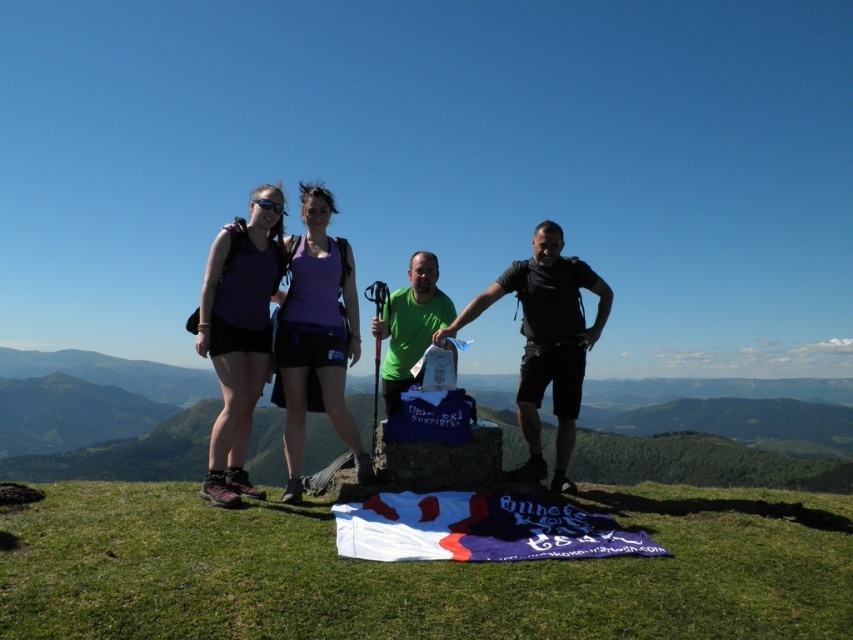
Question: Which object is closer to the camera taking this photo?

Choices:
 (A) matte purple shirt at left
 (B) green matte shirt at center
 (C) black matte shirt at center

Answer: (A)

Question: Which point is closer to the camera taking this photo?

Choices:
 (A) [262, 240]
 (B) [564, 269]

Answer: (A)

Question: Can you confirm if purple fabric tank top at center is positioned to the right of green matte shirt at center?

Choices:
 (A) yes
 (B) no

Answer: (B)

Question: Does black matte shirt at center have a smaller size compared to green matte shirt at center?

Choices:
 (A) no
 (B) yes

Answer: (A)

Question: Does matte purple shirt at left have a lesser width compared to black matte goggles at upper center?

Choices:
 (A) yes
 (B) no

Answer: (B)

Question: Which point is closer to the camera?

Choices:
 (A) green matte shirt at center
 (B) purple fabric tank top at center
 (C) black matte goggles at upper center

Answer: (B)